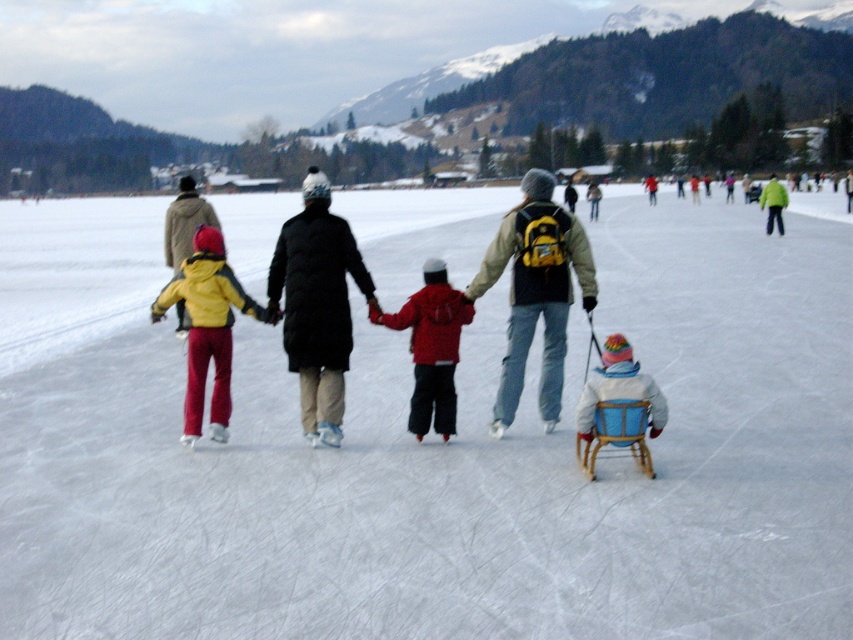
Question: Which point appears closest to the camera in this image?

Choices:
 (A) (224, 388)
 (B) (305, 300)

Answer: (B)

Question: Is yellow matte jacket at center positioned at the back of red matte jacket at center?

Choices:
 (A) yes
 (B) no

Answer: (A)

Question: Which object appears closest to the camera in this image?

Choices:
 (A) yellow matte jacket at center
 (B) red matte jacket at center
 (C) black puffy coat at center
 (D) yellow matte jacket at left

Answer: (B)

Question: Among these points, which one is farthest from the camera?

Choices:
 (A) (215, 426)
 (B) (430, 337)
 (C) (347, 337)

Answer: (A)

Question: Is black puffy coat at center closer to camera compared to yellow matte jacket at left?

Choices:
 (A) yes
 (B) no

Answer: (A)

Question: Can you confirm if white smooth ice at center is thinner than yellow matte jacket at left?

Choices:
 (A) no
 (B) yes

Answer: (A)